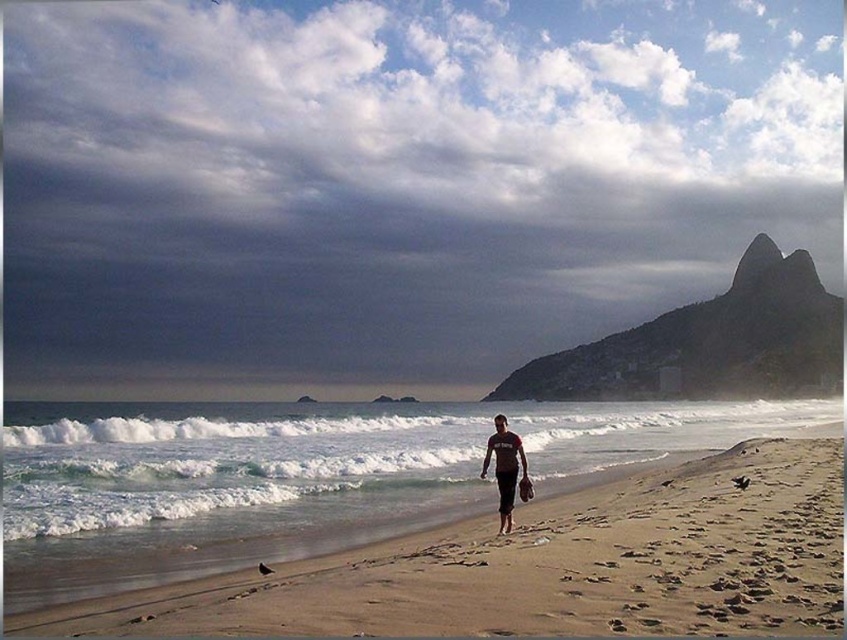
Question: Does matte black shorts at center have a greater width compared to smooth brown surfboard at center?

Choices:
 (A) no
 (B) yes

Answer: (B)

Question: Among these points, which one is farthest from the camera?

Choices:
 (A) (513, 458)
 (B) (806, 401)
 (C) (217, 577)

Answer: (B)

Question: Which point is farther to the camera?

Choices:
 (A) sandy beach at center
 (B) smooth brown surfboard at center

Answer: (B)

Question: Is matte black shorts at center to the right of smooth brown surfboard at center from the viewer's perspective?

Choices:
 (A) yes
 (B) no

Answer: (A)

Question: Estimate the real-world distances between objects in this image. Which object is farther from the white foamy wave at center?

Choices:
 (A) smooth brown surfboard at center
 (B) sandy beach at center

Answer: (A)

Question: Is white foamy wave at center bigger than smooth brown surfboard at center?

Choices:
 (A) yes
 (B) no

Answer: (A)